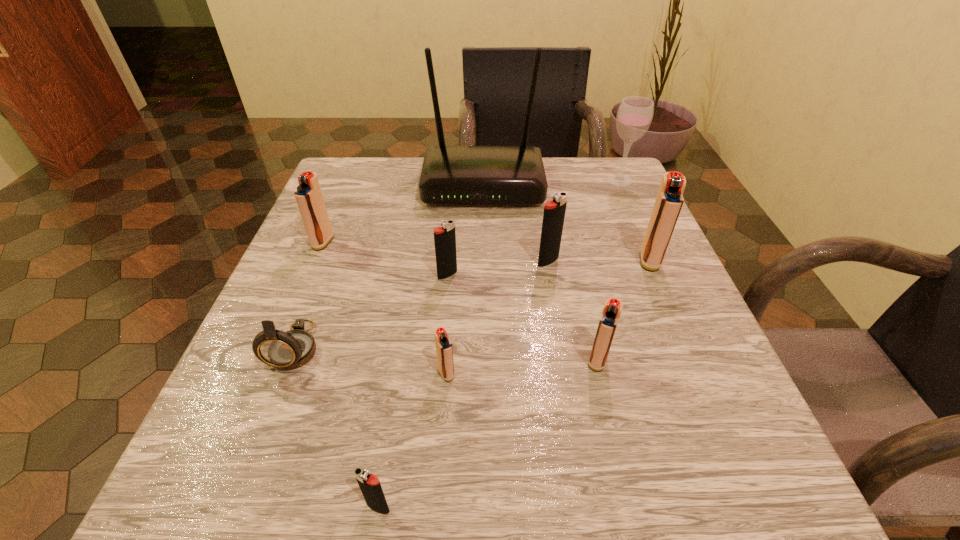
At what (x,y) coordinates should I click in order to perform the action: click on free space located 0.110m on the right of the biggest black igniter. Please return your answer as a coordinate pair (x, y). The image size is (960, 540). Looking at the image, I should click on (617, 261).

The height and width of the screenshot is (540, 960). I want to click on free space located 0.110m on the back of the second smallest black igniter, so click(451, 234).

Identify the location of free location located 0.340m on the left of the second red igniter from right to left. Image resolution: width=960 pixels, height=540 pixels. (363, 360).

At what (x,y) coordinates should I click in order to perform the action: click on free space located 0.050m on the face of the compass. Please return your answer as a coordinate pair (x, y). This screenshot has width=960, height=540. Looking at the image, I should click on (274, 407).

Where is `vacant area situated 0.220m on the left of the smallest red igniter`? The height and width of the screenshot is (540, 960). vacant area situated 0.220m on the left of the smallest red igniter is located at coordinates tap(289, 373).

Identify the location of vacant area situated 0.230m on the left of the nearest igniter. The width and height of the screenshot is (960, 540). coord(170,507).

The image size is (960, 540). I want to click on router that is positioned at the far edge, so click(x=450, y=174).

The width and height of the screenshot is (960, 540). I want to click on wineglass that is at the far edge, so click(634, 116).

You are a GUI agent. You are given a task and a screenshot of the screen. Output one action in this format:
    pyautogui.click(x=<x>, y=<y>)
    Task: Click on the object that is at the near edge
    The image size is (960, 540).
    Given the screenshot: What is the action you would take?
    pyautogui.click(x=370, y=486)

This screenshot has width=960, height=540. Identify the location of igniter that is at the left edge. (308, 195).